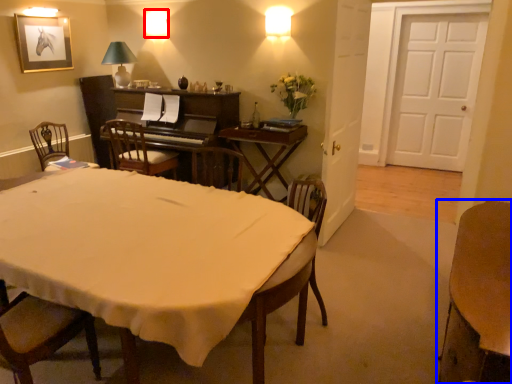
Question: Which of the following is the farthest to the observer, lamp (highlighted by a red box) or table (highlighted by a blue box)?

Choices:
 (A) lamp
 (B) table

Answer: (A)